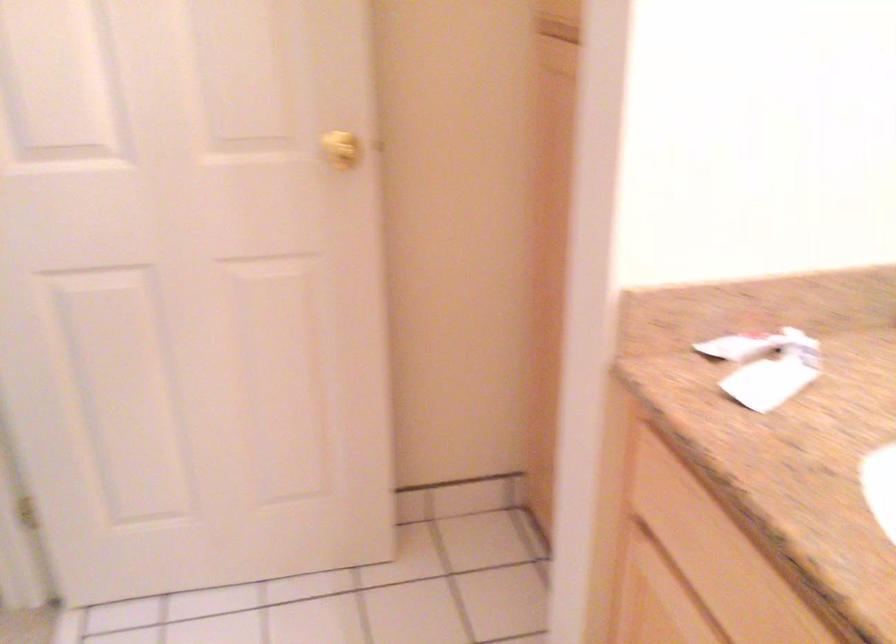
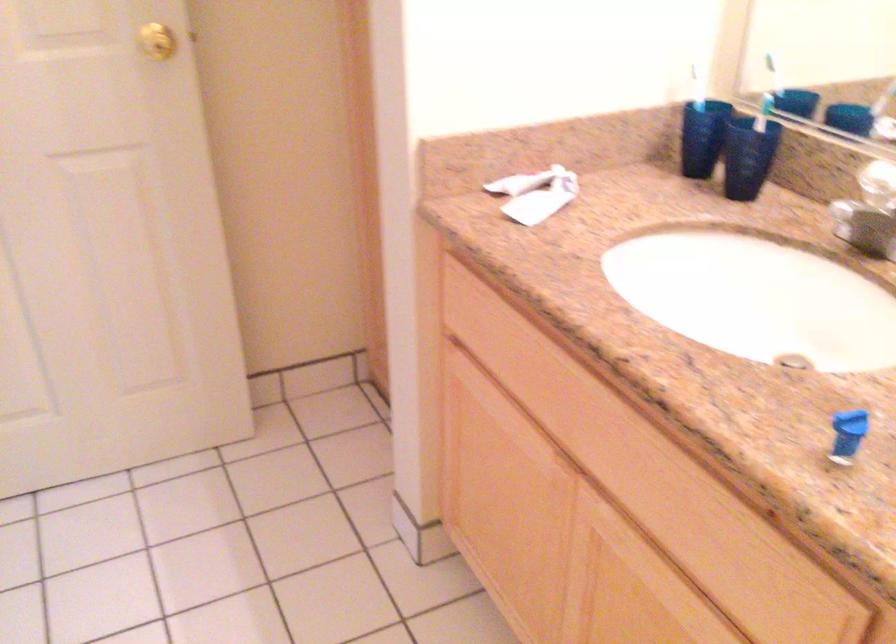
Question: The camera is either moving clockwise (left) or counter-clockwise (right) around the object. The first image is from the beginning of the video and the second image is from the end. Is the camera moving left or right when shooting the video?

Choices:
 (A) Left
 (B) Right

Answer: (A)